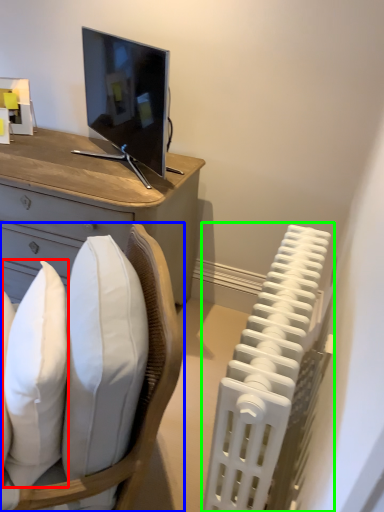
Question: Based on their relative distances, which object is nearer to pillow (highlighted by a red box)? Choose from chair (highlighted by a blue box) and radiator (highlighted by a green box).

Choices:
 (A) chair
 (B) radiator

Answer: (A)